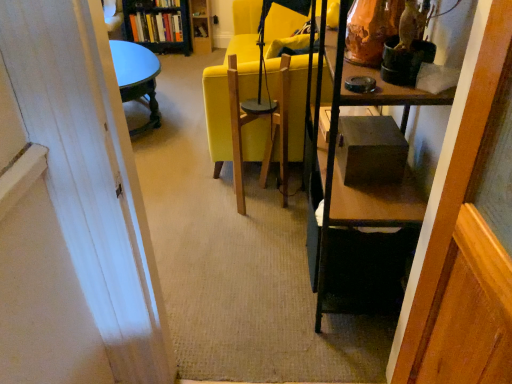
This screenshot has height=384, width=512. What are the coordinates of `vacant space to the left of wooden swivel chair at center` in the screenshot? It's located at (212, 203).